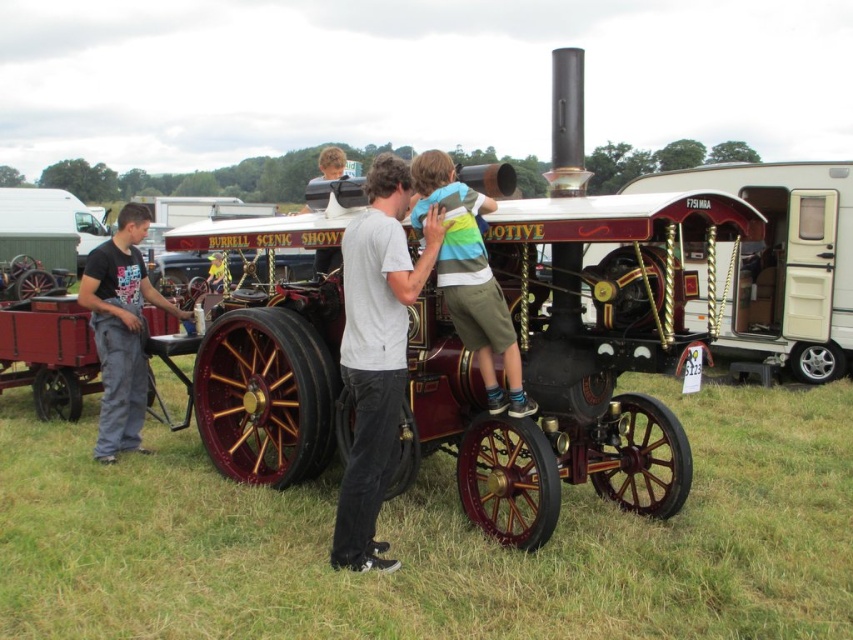
Question: Which point appears farthest from the camera in this image?

Choices:
 (A) (100, 460)
 (B) (444, 243)
 (C) (384, 378)

Answer: (A)

Question: Considering the relative positions of striped cotton shirt at center and dark gray jeans at left in the image provided, where is striped cotton shirt at center located with respect to dark gray jeans at left?

Choices:
 (A) below
 (B) above

Answer: (B)

Question: Where is striped cotton shirt at center located in relation to dark gray jeans at left in the image?

Choices:
 (A) above
 (B) below

Answer: (A)

Question: Which object appears farthest from the camera in this image?

Choices:
 (A) light gray cotton t-shirt at center
 (B) dark gray jeans at left

Answer: (B)

Question: Is light gray cotton t-shirt at center positioned behind dark gray jeans at left?

Choices:
 (A) no
 (B) yes

Answer: (A)

Question: Which object is positioned closest to the striped cotton shirt at center?

Choices:
 (A) dark gray jeans at left
 (B) light gray cotton t-shirt at center

Answer: (B)